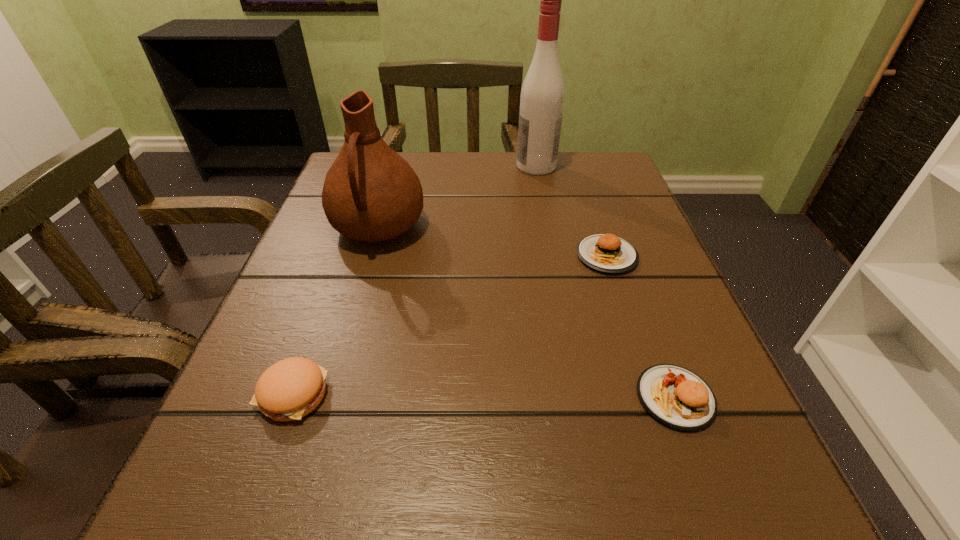
Where is `vacant space located on the back of the third shortest object`? vacant space located on the back of the third shortest object is located at coordinates (618, 247).

The height and width of the screenshot is (540, 960). What are the coordinates of `free region located on the back of the leftmost food` in the screenshot? It's located at (344, 254).

At what (x,y) coordinates should I click in order to perform the action: click on free region located on the left of the farthest food. Please return your answer as a coordinate pair (x, y). The width and height of the screenshot is (960, 540). Looking at the image, I should click on (377, 256).

Locate an element on the screen. The width and height of the screenshot is (960, 540). alcohol at the far edge is located at coordinates (542, 96).

This screenshot has height=540, width=960. I want to click on pitcher present at the far edge, so click(x=371, y=194).

Find the location of a particular element. pitcher present at the left edge is located at coordinates pos(371,194).

The image size is (960, 540). I want to click on patty that is at the left edge, so click(x=290, y=389).

Locate an element on the screen. alcohol that is at the right edge is located at coordinates (542, 96).

Where is `object that is at the far left corner`? The image size is (960, 540). object that is at the far left corner is located at coordinates (371, 194).

Find the location of a particular element. The image size is (960, 540). object at the far right corner is located at coordinates (542, 96).